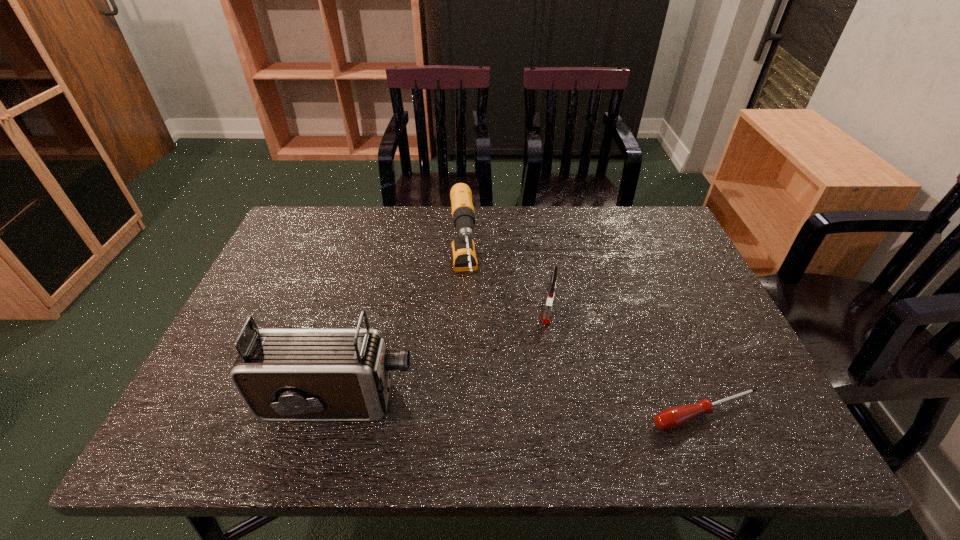
At what (x,y) coordinates should I click in order to perform the action: click on free space at the far edge of the desktop. Please return your answer as a coordinate pair (x, y). The width and height of the screenshot is (960, 540). Looking at the image, I should click on (550, 245).

Identify the location of vacant area at the near edge. (476, 373).

Locate an element on the screen. This screenshot has width=960, height=540. free region at the left edge of the desktop is located at coordinates pos(310,264).

Identify the location of free space at the right edge of the desktop. (710, 330).

Locate an element on the screen. Image resolution: width=960 pixels, height=540 pixels. vacant space at the far left corner of the desktop is located at coordinates (336, 222).

The height and width of the screenshot is (540, 960). I want to click on vacant space at the far right corner of the desktop, so click(622, 216).

The width and height of the screenshot is (960, 540). Find the location of `empty space that is in between the second object from right to left and the drill`. empty space that is in between the second object from right to left and the drill is located at coordinates (507, 292).

Locate an element on the screen. The height and width of the screenshot is (540, 960). free area in between the stapler and the leftmost object is located at coordinates (444, 354).

Locate an element on the screen. The height and width of the screenshot is (540, 960). empty location between the leftmost object and the second shortest object is located at coordinates (444, 354).

At what (x,y) coordinates should I click in order to perform the action: click on vacant point located between the screwdriver and the stapler. Please return your answer as a coordinate pair (x, y). The height and width of the screenshot is (540, 960). Looking at the image, I should click on (628, 360).